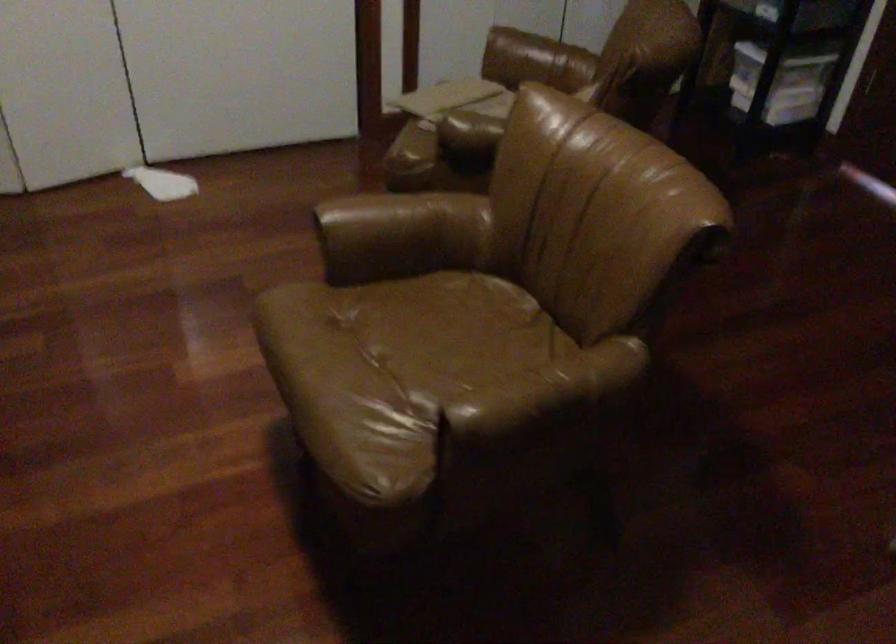
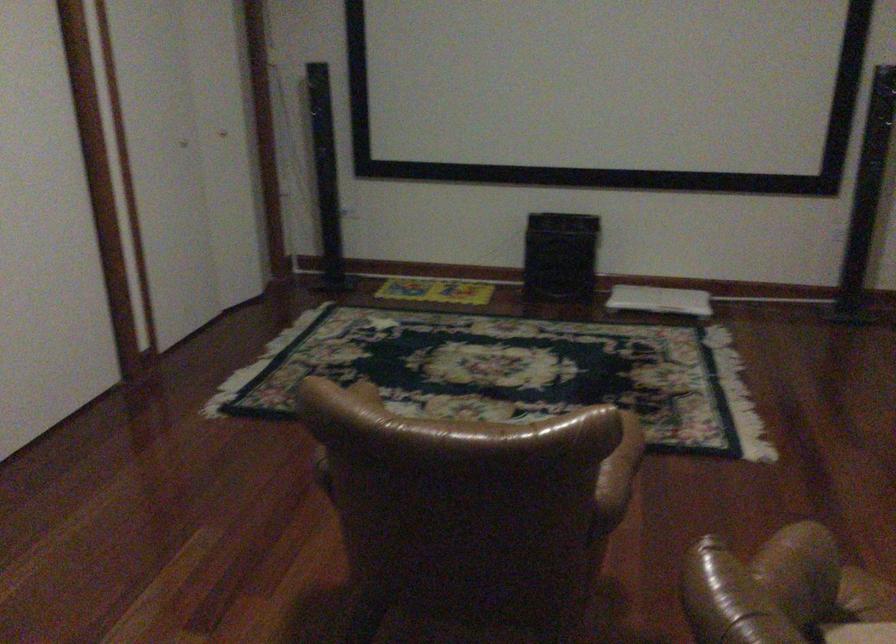
Find the pixel in the second image that matches (x=389, y=212) in the first image.

(622, 460)